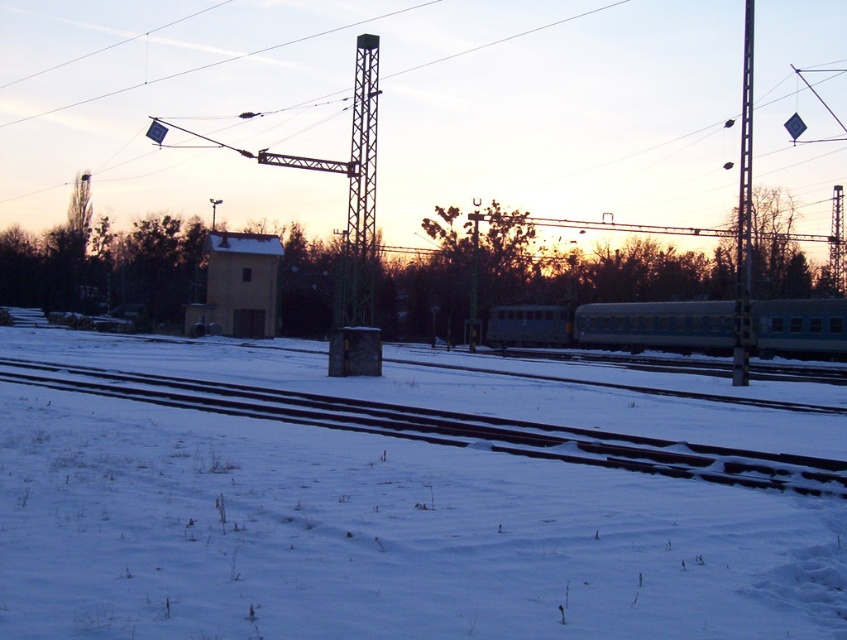
Question: Which point is closer to the camera?

Choices:
 (A) pyautogui.click(x=712, y=314)
 (B) pyautogui.click(x=401, y=426)

Answer: (B)

Question: Can you confirm if gray metallic train at center is positioned below metallic pole at right?

Choices:
 (A) no
 (B) yes

Answer: (B)

Question: Which object is closer to the camera taking this photo?

Choices:
 (A) smooth steel tracks at lower center
 (B) metallic pole at right

Answer: (A)

Question: From the image, what is the correct spatial relationship of smooth steel tracks at lower center in relation to gray metallic train at center?

Choices:
 (A) above
 (B) below

Answer: (B)

Question: Considering the real-world distances, which object is farthest from the metallic pole at right?

Choices:
 (A) metallic tower at center
 (B) gray metallic train at center

Answer: (A)

Question: Is smooth steel tracks at lower center smaller than metallic pole at right?

Choices:
 (A) yes
 (B) no

Answer: (A)